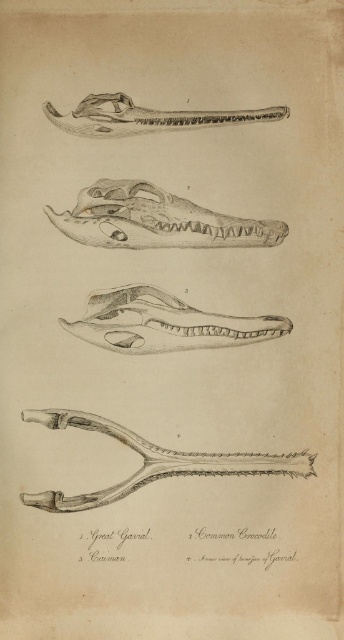
Is matte black skull at center bigger than matte gray skull at center?

Yes, matte black skull at center is bigger than matte gray skull at center.

Between point (152, 212) and point (82, 326), which one is positioned in front?

Positioned in front is point (152, 212).

Find the location of a particular element. This screenshot has width=344, height=640. matte black skull at center is located at coordinates (155, 220).